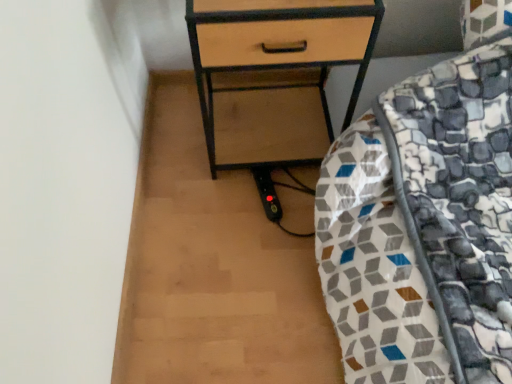
At what (x,y) coordinates should I click in order to perform the action: click on vacant area that is in front of woodenmaterial/texturechest of drawers at upper center. Please return your answer as a coordinate pair (x, y). Looking at the image, I should click on (242, 228).